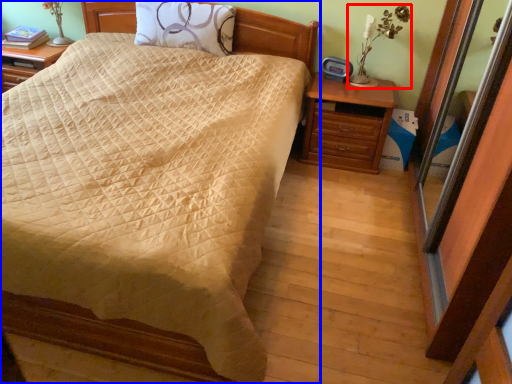
Question: Which object appears farthest to the camera in this image, table lamp (highlighted by a red box) or bed (highlighted by a blue box)?

Choices:
 (A) table lamp
 (B) bed

Answer: (A)